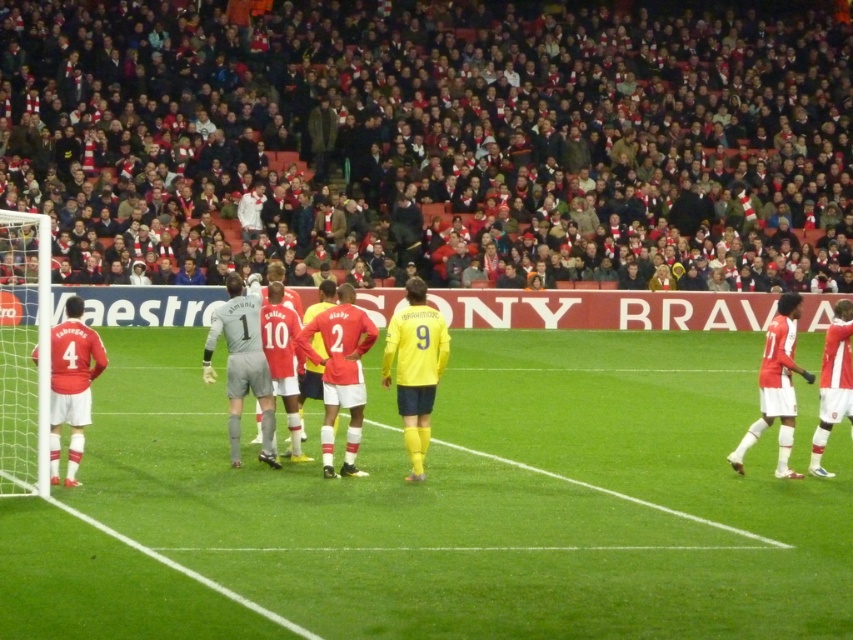
Does green grass field at lower left have a smaller size compared to yellow matte jersey at center?

Actually, green grass field at lower left might be larger than yellow matte jersey at center.

Who is higher up, green grass field at lower left or yellow matte jersey at center?

yellow matte jersey at center

Between point (689, 349) and point (308, 326), which one is positioned behind?

The point (689, 349) is more distant.

Find the location of `green grass field at lower left`. green grass field at lower left is located at coordinates (492, 497).

Is point (799, 76) in front of point (540, 588)?

That is False.

From the picture: Who is taller, red scarf at upper center or green grass field at lower left?

Standing taller between the two is red scarf at upper center.

Is point (398, 189) positioned after point (537, 416)?

Yes, it is behind point (537, 416).

What are the coordinates of `red scarf at upper center` in the screenshot? It's located at (433, 140).

Is white plastic goal at left positioned behind yellow matte jersey at center?

No, white plastic goal at left is in front of yellow matte jersey at center.

What do you see at coordinates (22, 353) in the screenshot?
I see `white plastic goal at left` at bounding box center [22, 353].

The width and height of the screenshot is (853, 640). What do you see at coordinates (22, 353) in the screenshot?
I see `white plastic goal at left` at bounding box center [22, 353].

In order to click on white plastic goal at left in this screenshot , I will do `click(22, 353)`.